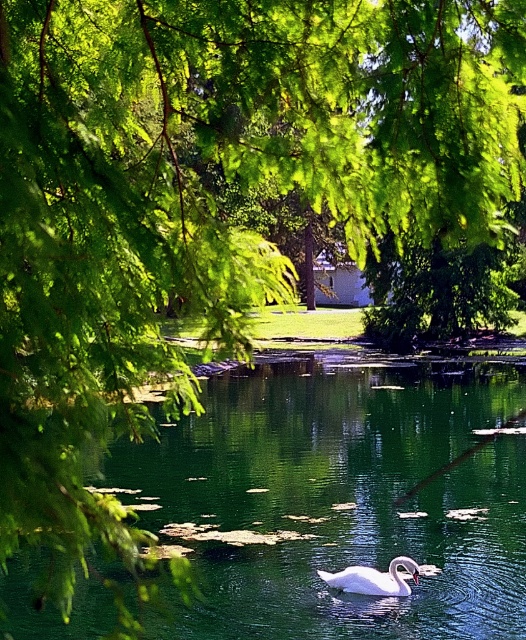
Measure the distance between green glossy lake at center and white glossy swan at center.

green glossy lake at center and white glossy swan at center are 7.45 meters apart.

Is green glossy lake at center shorter than white glossy swan at center?

In fact, green glossy lake at center may be taller than white glossy swan at center.

Where is `green glossy lake at center`? green glossy lake at center is located at coordinates (340, 497).